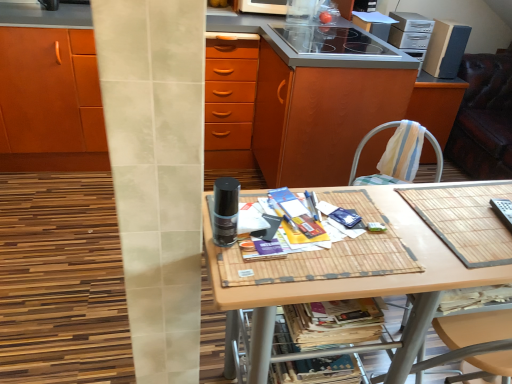
Where is `empty space that is to the right of matte paper magazine at center, arranged as the 1th magazine when viewed from the top`? This screenshot has width=512, height=384. empty space that is to the right of matte paper magazine at center, arranged as the 1th magazine when viewed from the top is located at coordinates (360, 242).